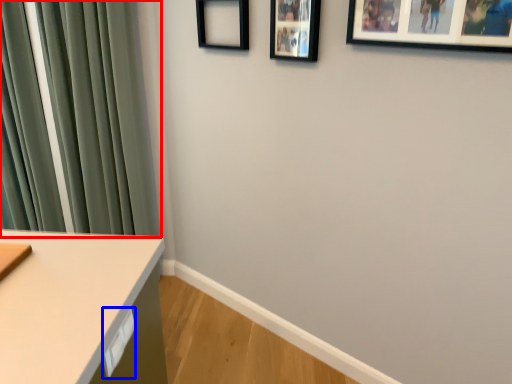
Question: Which object is closer to the camera taking this photo, curtain (highlighted by a red box) or drawer (highlighted by a blue box)?

Choices:
 (A) curtain
 (B) drawer

Answer: (B)